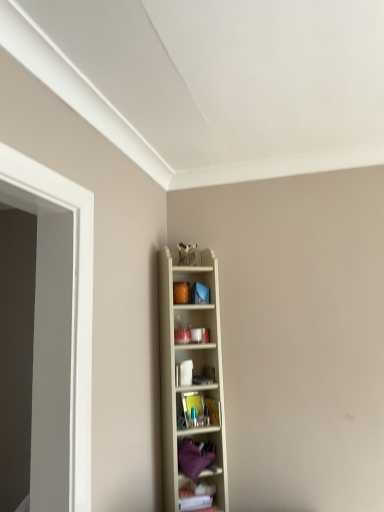
Question: Does purple fabric at center, which appears as the 2th shelf when viewed from the top, have a lesser width compared to wooden shelf at center, which appears as the 3th shelf when ordered from the bottom?

Choices:
 (A) no
 (B) yes

Answer: (A)

Question: Is purple fabric at center, which appears as the 2th shelf when viewed from the top, beside wooden shelf at center, which appears as the 3th shelf when ordered from the bottom?

Choices:
 (A) yes
 (B) no

Answer: (B)

Question: Is purple fabric at center, which appears as the 2th shelf when viewed from the top, outside of wooden shelf at center, positioned as the first shelf in top-to-bottom order?

Choices:
 (A) yes
 (B) no

Answer: (B)

Question: From the image's perspective, is purple fabric at center, marked as the second shelf in a bottom-to-top arrangement, over wooden shelf at center, which appears as the 3th shelf when ordered from the bottom?

Choices:
 (A) no
 (B) yes

Answer: (A)

Question: Does purple fabric at center, marked as the second shelf in a bottom-to-top arrangement, come behind wooden shelf at center, positioned as the first shelf in top-to-bottom order?

Choices:
 (A) yes
 (B) no

Answer: (A)

Question: From a real-world perspective, is purple fabric at center, which appears as the 2th shelf when viewed from the top, above or below wooden shelf at center, which appears as the 3th shelf when ordered from the bottom?

Choices:
 (A) below
 (B) above

Answer: (A)

Question: Is purple fabric at center, marked as the second shelf in a bottom-to-top arrangement, to the left or to the right of wooden shelf at center, positioned as the first shelf in top-to-bottom order, in the image?

Choices:
 (A) left
 (B) right

Answer: (B)

Question: Based on their sizes in the image, would you say purple fabric at center, marked as the second shelf in a bottom-to-top arrangement, is bigger or smaller than wooden shelf at center, which appears as the 3th shelf when ordered from the bottom?

Choices:
 (A) small
 (B) big

Answer: (A)

Question: Is purple fabric at center, marked as the second shelf in a bottom-to-top arrangement, in front of or behind wooden shelf at center, which appears as the 3th shelf when ordered from the bottom, in the image?

Choices:
 (A) front
 (B) behind

Answer: (B)

Question: From a real-world perspective, is purple fabric at center, marked as the second shelf in a bottom-to-top arrangement, positioned above or below white plastic shelf at lower right, the 3th shelf positioned from the top?

Choices:
 (A) above
 (B) below

Answer: (A)

Question: Is purple fabric at center, which appears as the 2th shelf when viewed from the top, bigger or smaller than white plastic shelf at lower right, the 3th shelf positioned from the top?

Choices:
 (A) small
 (B) big

Answer: (B)

Question: Would you say purple fabric at center, which appears as the 2th shelf when viewed from the top, is to the left or to the right of white plastic shelf at lower right, which is the 1th shelf in bottom-to-top order, in the picture?

Choices:
 (A) left
 (B) right

Answer: (A)

Question: In the image, is purple fabric at center, which appears as the 2th shelf when viewed from the top, positioned in front of or behind white plastic shelf at lower right, the 3th shelf positioned from the top?

Choices:
 (A) behind
 (B) front

Answer: (B)

Question: From a real-world perspective, is white plastic shelf at lower right, the 3th shelf positioned from the top, positioned above or below purple fabric at center, which appears as the 2th shelf when viewed from the top?

Choices:
 (A) above
 (B) below

Answer: (B)

Question: Looking at their shapes, would you say white plastic shelf at lower right, which is the 1th shelf in bottom-to-top order, is wider or thinner than purple fabric at center, marked as the second shelf in a bottom-to-top arrangement?

Choices:
 (A) wide
 (B) thin

Answer: (B)